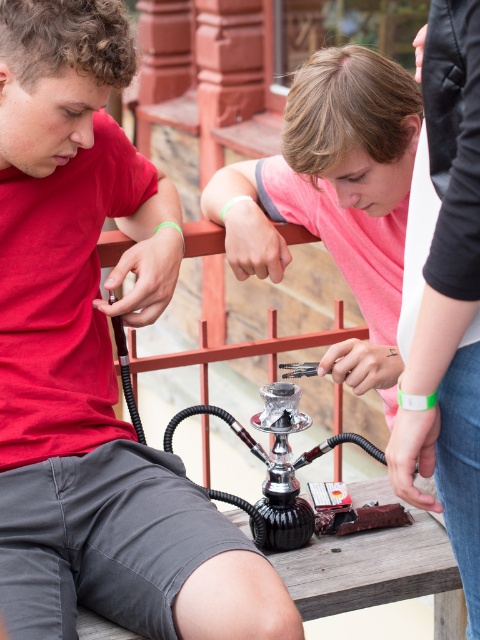
You are a delivery person who needs to place a small package between the matte black hookah at center and the metallic shisha at center. Can you fit it there?

The distance between the matte black hookah at center and the metallic shisha at center is 17.82 inches, so the small package can be placed there as there is enough space.

You are a person who wants to know which object is taller between the matte black hookah at center and the metallic shisha at center. Based on the scene, can you determine which one is taller?

The matte black hookah at center is taller than the metallic shisha at center.

You are standing in the park and see the matte black hookah at center and the metallic shisha at center. Which object is nearer to you?

The matte black hookah at center is closer to the viewer than the metallic shisha at center.